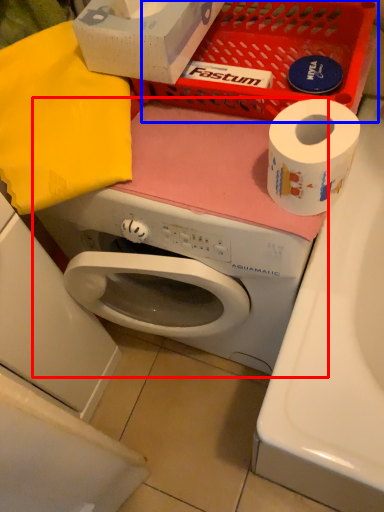
Question: Which object appears farthest to the camera in this image, washing machine (highlighted by a red box) or basket (highlighted by a blue box)?

Choices:
 (A) washing machine
 (B) basket

Answer: (B)